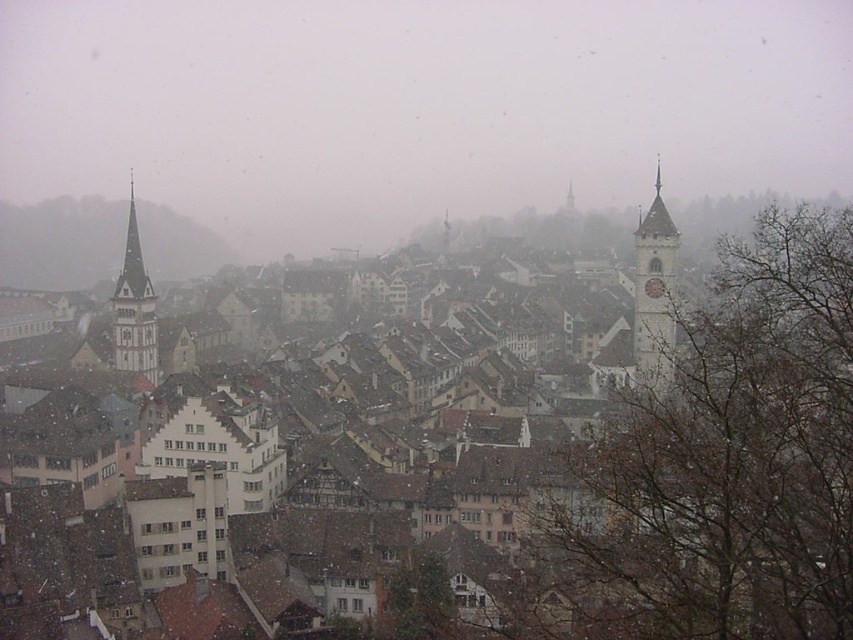
Is white stone clock tower at right above white stone bell tower at left?

No.

Is the position of white stone clock tower at right less distant than that of white stone bell tower at left?

Yes, white stone clock tower at right is closer to the viewer.

Does point (657, 380) come closer to viewer compared to point (120, 358)?

Yes, it is.

The image size is (853, 640). What are the coordinates of `white stone clock tower at right` in the screenshot? It's located at (654, 296).

The image size is (853, 640). I want to click on brown tiled roofs at center, so pos(727,460).

Is brown tiled roofs at center bigger than white stone bell tower at left?

Yes.

The height and width of the screenshot is (640, 853). Describe the element at coordinates (727, 460) in the screenshot. I see `brown tiled roofs at center` at that location.

Image resolution: width=853 pixels, height=640 pixels. I want to click on brown tiled roofs at center, so click(x=727, y=460).

Does brown tiled roofs at center have a greater height compared to white stone clock tower at right?

Yes, brown tiled roofs at center is taller than white stone clock tower at right.

Is brown tiled roofs at center wider than white stone clock tower at right?

Correct, the width of brown tiled roofs at center exceeds that of white stone clock tower at right.

Is point (764, 227) positioned in front of point (642, 291)?

Yes.

Identify the location of brown tiled roofs at center. This screenshot has height=640, width=853. (727, 460).